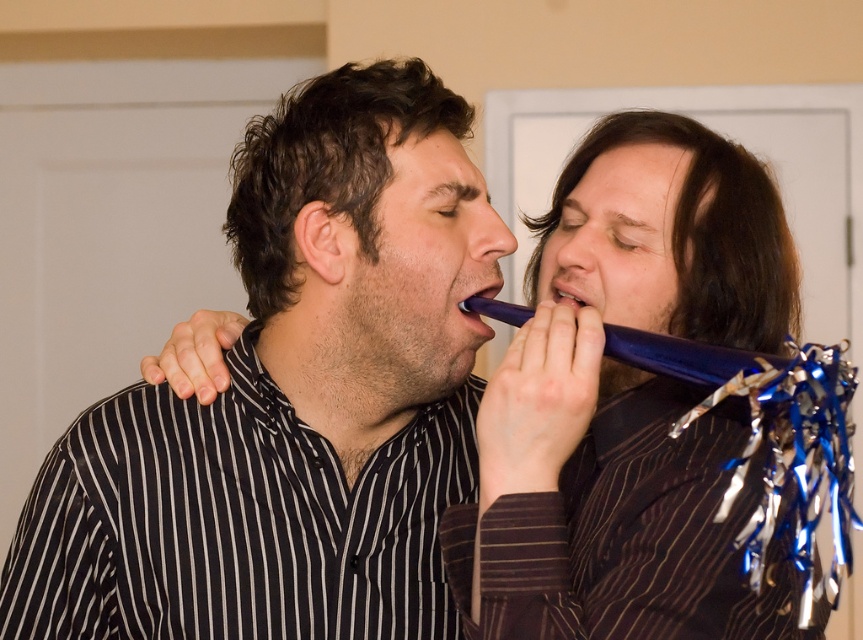
Does matte black shirt at left have a lesser height compared to matte plastic mouth at center?

Incorrect, matte black shirt at left's height does not fall short of matte plastic mouth at center's.

Does matte black shirt at left come behind matte plastic mouth at center?

No, it is not.

Image resolution: width=863 pixels, height=640 pixels. Describe the element at coordinates (293, 401) in the screenshot. I see `matte black shirt at left` at that location.

Locate an element on the screen. This screenshot has width=863, height=640. matte black shirt at left is located at coordinates (293, 401).

Can you confirm if matte blue plastic toothbrush at upper right is positioned to the left of blue shiny plastic mouth at center?

In fact, matte blue plastic toothbrush at upper right is to the right of blue shiny plastic mouth at center.

Does point (734, 362) come farther from viewer compared to point (468, 312)?

No, (734, 362) is closer to viewer.

Image resolution: width=863 pixels, height=640 pixels. In order to click on matte blue plastic toothbrush at upper right in this screenshot , I will do `click(681, 356)`.

Does shiny blue plastic horn at center appear on the right side of blue shiny plastic mouth at center?

Correct, you'll find shiny blue plastic horn at center to the right of blue shiny plastic mouth at center.

Who is more forward, (717, 220) or (508, 305)?

Positioned in front is point (508, 305).

Locate an element on the screen. This screenshot has height=640, width=863. shiny blue plastic horn at center is located at coordinates (628, 403).